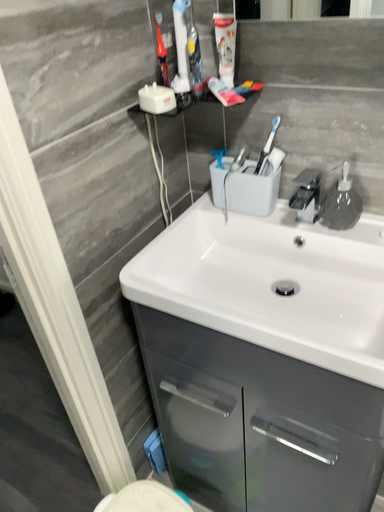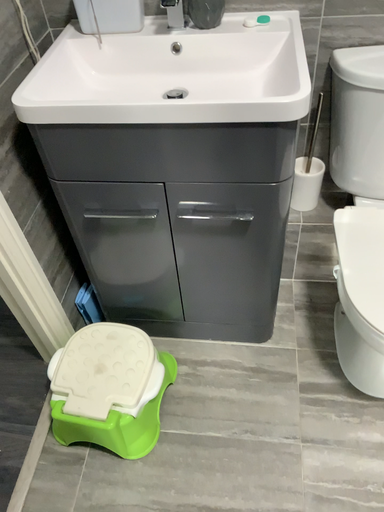
Question: Which way did the camera rotate in the video?

Choices:
 (A) rotated downward
 (B) rotated upward

Answer: (A)